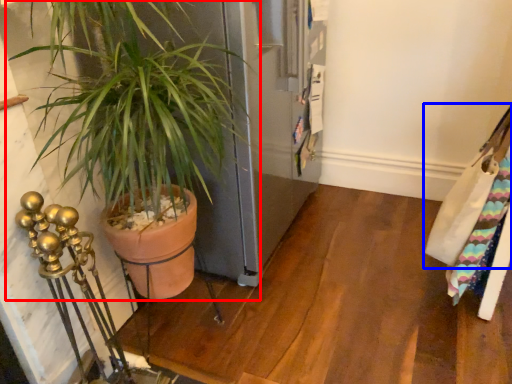
Question: Which point is further to the camera, houseplant (highlighted by a red box) or messenger bag (highlighted by a blue box)?

Choices:
 (A) houseplant
 (B) messenger bag

Answer: (B)